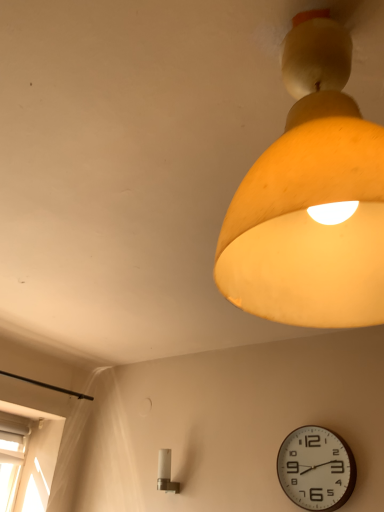
Question: Would you say white glossy light fixture at lower center, placed as the second lamp when sorted from front to back, contains matte yellow lampshade at upper right, the 1th lamp in the right-to-left sequence?

Choices:
 (A) no
 (B) yes

Answer: (A)

Question: Can you confirm if white glossy light fixture at lower center, which appears as the 1th lamp when ordered from the bottom, is smaller than matte yellow lampshade at upper right, positioned as the second lamp in back-to-front order?

Choices:
 (A) no
 (B) yes

Answer: (B)

Question: Is white glossy light fixture at lower center, which appears as the 1th lamp when ordered from the bottom, closer to camera compared to matte yellow lampshade at upper right, the first lamp from the top?

Choices:
 (A) no
 (B) yes

Answer: (A)

Question: Is white glossy light fixture at lower center, the second lamp in the right-to-left sequence, facing towards matte yellow lampshade at upper right, the 1th lamp in the right-to-left sequence?

Choices:
 (A) no
 (B) yes

Answer: (A)

Question: Is there a large distance between white glossy light fixture at lower center, placed as the second lamp when sorted from front to back, and matte yellow lampshade at upper right, the 2th lamp when ordered from bottom to top?

Choices:
 (A) no
 (B) yes

Answer: (B)

Question: Considering the relative positions of white glossy light fixture at lower center, which appears as the second lamp when viewed from the top, and matte yellow lampshade at upper right, the 2th lamp when ordered from bottom to top, in the image provided, is white glossy light fixture at lower center, which appears as the second lamp when viewed from the top, to the right of matte yellow lampshade at upper right, the 2th lamp when ordered from bottom to top, from the viewer's perspective?

Choices:
 (A) no
 (B) yes

Answer: (A)

Question: Is white plastic clock at lower right positioned beyond the bounds of white glossy light fixture at lower center, which is counted as the 1th lamp, starting from the left?

Choices:
 (A) no
 (B) yes

Answer: (B)

Question: Does white plastic clock at lower right appear on the right side of white glossy light fixture at lower center, which appears as the second lamp when viewed from the top?

Choices:
 (A) yes
 (B) no

Answer: (A)

Question: Is the position of white plastic clock at lower right less distant than that of white glossy light fixture at lower center, the second lamp in the right-to-left sequence?

Choices:
 (A) no
 (B) yes

Answer: (B)

Question: Is the depth of white plastic clock at lower right greater than that of white glossy light fixture at lower center, which appears as the 1th lamp when ordered from the bottom?

Choices:
 (A) no
 (B) yes

Answer: (A)

Question: From a real-world perspective, is white plastic clock at lower right located higher than white glossy light fixture at lower center, the second lamp in the right-to-left sequence?

Choices:
 (A) no
 (B) yes

Answer: (B)

Question: Is white plastic clock at lower right positioned with its back to white glossy light fixture at lower center, which appears as the second lamp when viewed from the top?

Choices:
 (A) no
 (B) yes

Answer: (A)

Question: From the image's perspective, is matte yellow lampshade at upper right, which is the second lamp in left-to-right order, on top of white glossy light fixture at lower center, placed as the second lamp when sorted from front to back?

Choices:
 (A) yes
 (B) no

Answer: (A)